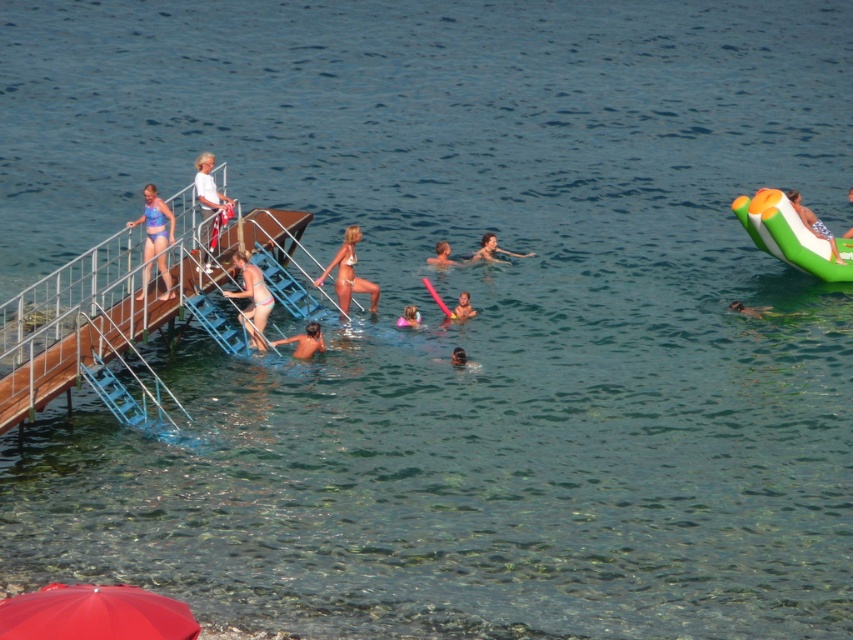
Question: Does green inflatable raft at right have a lesser width compared to smooth pink float at center?

Choices:
 (A) no
 (B) yes

Answer: (A)

Question: Which point is closer to the camera?

Choices:
 (A) matte pink swim ring at center
 (B) matte white bikini at center

Answer: (B)

Question: Is white matte shirt at upper left above green inflatable float at right?

Choices:
 (A) yes
 (B) no

Answer: (A)

Question: Which of these objects is positioned closest to the metallic silver dock at upper left?

Choices:
 (A) matte blue bikini at left
 (B) light pink bikini at center
 (C) green inflatable float at right

Answer: (B)

Question: In this image, where is matte blue bikini at left located relative to smooth brown hair at center?

Choices:
 (A) below
 (B) above

Answer: (B)

Question: Which point is farther to the camera?

Choices:
 (A) red matte umbrella at lower left
 (B) matte white bikini at center
 (C) smooth green float at upper right
 (D) smooth pink float at center

Answer: (C)